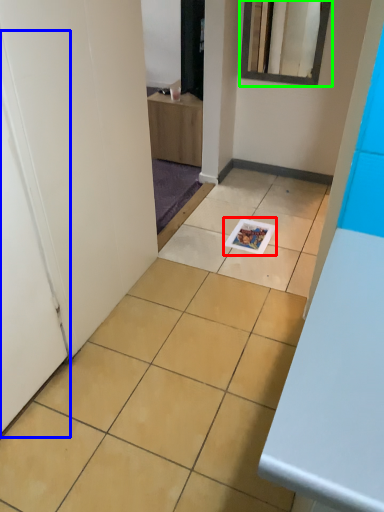
Question: Estimate the real-world distances between objects in this image. Which object is closer to magazine (highlighted by a red box), door (highlighted by a blue box) or mirror (highlighted by a green box)?

Choices:
 (A) door
 (B) mirror

Answer: (B)